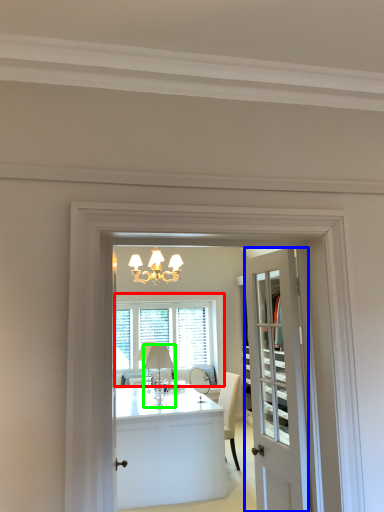
Question: Based on their relative distances, which object is nearer to window (highlighted by a red box)? Choose from door (highlighted by a blue box) and lamp (highlighted by a green box).

Choices:
 (A) door
 (B) lamp

Answer: (B)